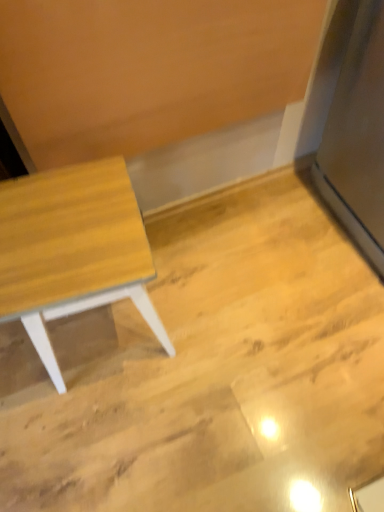
Question: Looking at their shapes, would you say satin silver fridge at right is wider or thinner than light wood table at left?

Choices:
 (A) thin
 (B) wide

Answer: (B)

Question: In the image, is satin silver fridge at right on the left side or the right side of light wood table at left?

Choices:
 (A) right
 (B) left

Answer: (A)

Question: From the image's perspective, is satin silver fridge at right located above or below light wood table at left?

Choices:
 (A) above
 (B) below

Answer: (A)

Question: Is light wood table at left situated inside satin silver fridge at right or outside?

Choices:
 (A) inside
 (B) outside

Answer: (B)

Question: From the image's perspective, relative to satin silver fridge at right, is light wood table at left above or below?

Choices:
 (A) above
 (B) below

Answer: (B)

Question: Considering the positions of point (54, 223) and point (334, 115), is point (54, 223) closer or farther from the camera than point (334, 115)?

Choices:
 (A) closer
 (B) farther

Answer: (A)

Question: Considering their positions, is light wood table at left located in front of or behind satin silver fridge at right?

Choices:
 (A) behind
 (B) front

Answer: (A)